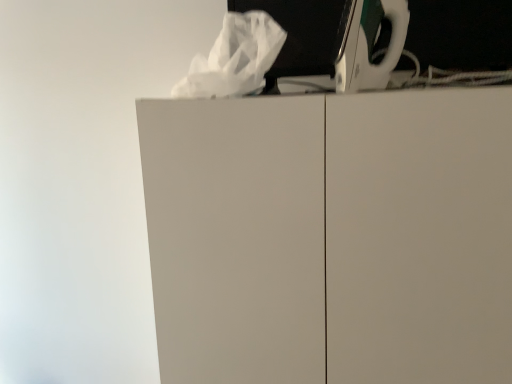
Question: Should I look upward or downward to see white matte cabinet at center?

Choices:
 (A) down
 (B) up

Answer: (A)